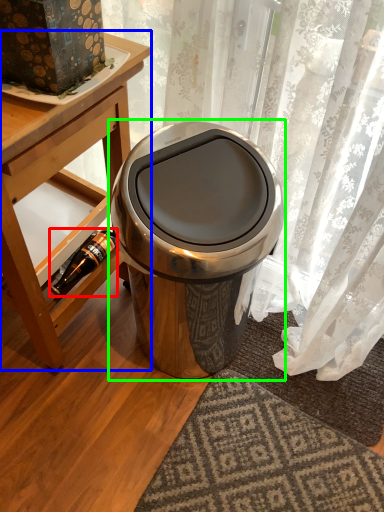
Question: Which is nearer to the bottle (highlighted by a red box)? table (highlighted by a blue box) or waste container (highlighted by a green box).

Choices:
 (A) table
 (B) waste container

Answer: (A)